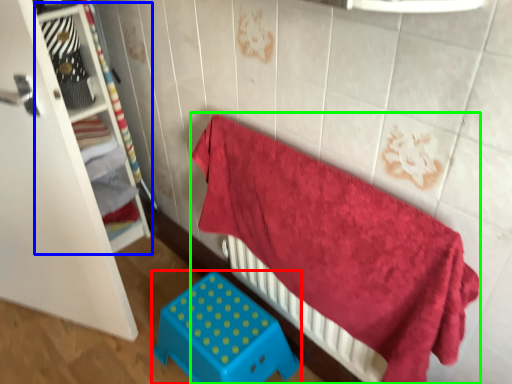
Question: Based on their relative distances, which object is nearer to furniture (highlighted by a red box)? Choose from shelf (highlighted by a blue box) and bed (highlighted by a green box).

Choices:
 (A) shelf
 (B) bed

Answer: (B)